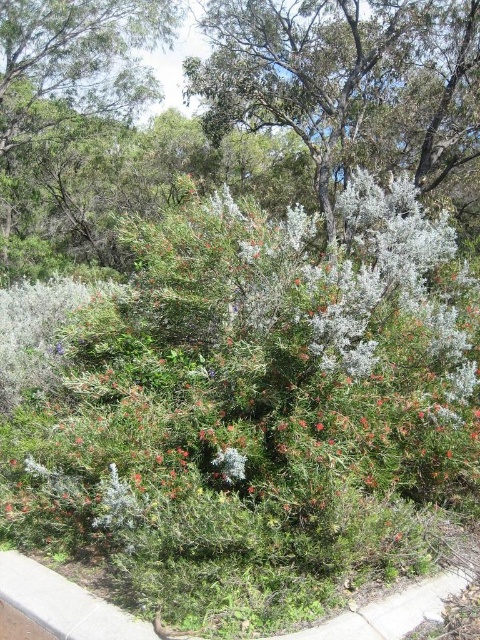
You are a gardener planning to plant a new tree in your backyard. You want to ensure there is enough space between the green leafy bush at center and the white fluffy bush at upper center. What is the minimum distance you should maintain between these two bushes?

The green leafy bush at center and the white fluffy bush at upper center are 11.26 meters apart. Therefore, you should maintain a minimum distance of at least 11.26 meters between them to ensure adequate space.

You are an environmental scientist observing the scene. You notice the white fluffy bush at upper center and the green leafy tree at upper left. Which one has a smaller size?

The white fluffy bush at upper center is smaller than the green leafy tree at upper left.

You are standing in a garden and see the green leafy bush at center. Can you determine its exact coordinates based on the garden layout?

The green leafy bush at center is located at point coordinates of (x=252, y=387).